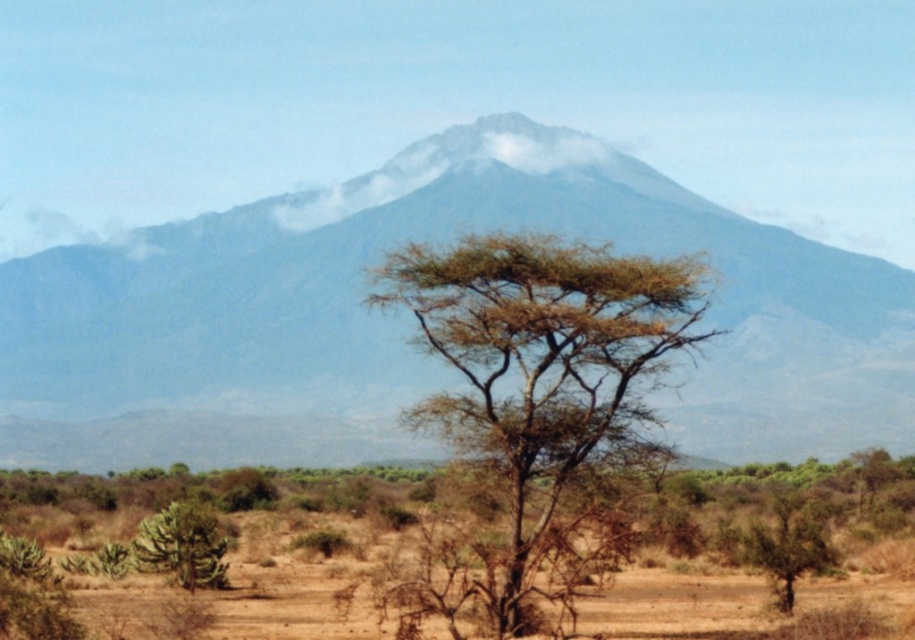
Who is shorter, brown leafy tree at center or brown rough tree at center?

brown leafy tree at center

Between brown leafy tree at center and brown rough tree at center, which one has more height?

Standing taller between the two is brown rough tree at center.

The width and height of the screenshot is (915, 640). Describe the element at coordinates (537, 387) in the screenshot. I see `brown leafy tree at center` at that location.

Where is `brown leafy tree at center`? This screenshot has height=640, width=915. brown leafy tree at center is located at coordinates (537, 387).

Between gray/dusty rock mountain at upper center and brown dry soil at center, which one is positioned higher?

gray/dusty rock mountain at upper center

Who is lower down, gray/dusty rock mountain at upper center or brown dry soil at center?

brown dry soil at center is lower down.

Is point (768, 435) positioned in front of point (663, 573)?

No, it is behind (663, 573).

Identify the location of gray/dusty rock mountain at upper center. The height and width of the screenshot is (640, 915). (405, 326).

Can you confirm if brown dry soil at center is wider than green spiky bush at lower left?

Indeed, brown dry soil at center has a greater width compared to green spiky bush at lower left.

Is the position of brown dry soil at center more distant than that of green spiky bush at lower left?

No, brown dry soil at center is closer to the viewer.

Find the location of a particular element. The width and height of the screenshot is (915, 640). brown dry soil at center is located at coordinates (743, 605).